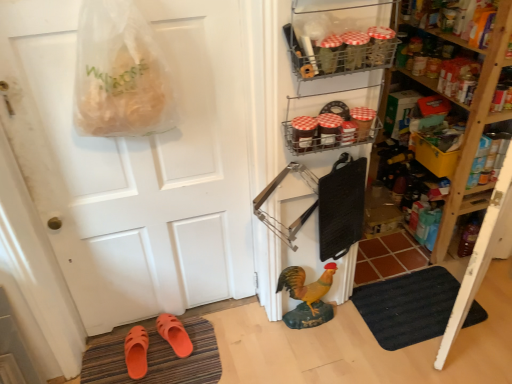
Identify the location of vacant space in front of painted wood rooster at lower center. This screenshot has height=384, width=512. (311, 354).